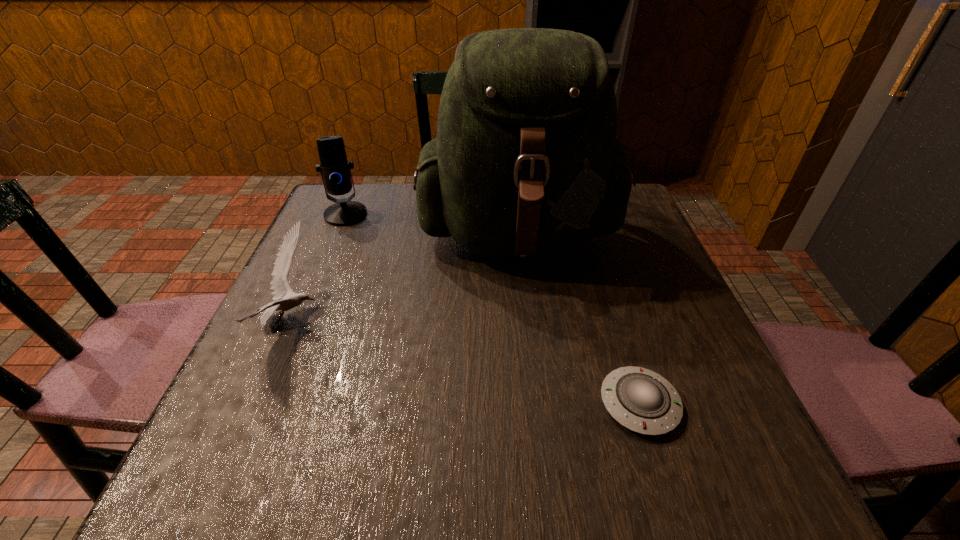
Locate an element on the screen. This screenshot has width=960, height=540. object located in the near edge section of the desktop is located at coordinates (641, 400).

The width and height of the screenshot is (960, 540). What are the coordinates of `microphone that is at the left edge` in the screenshot? It's located at (334, 168).

Find the location of a particular element. Image resolution: width=960 pixels, height=540 pixels. gull that is at the left edge is located at coordinates coord(280,287).

Find the location of `backpack that is at the right edge`. backpack that is at the right edge is located at coordinates (526, 161).

Where is `saucer that is at the right edge`? saucer that is at the right edge is located at coordinates (641, 400).

Identify the location of object situated at the far left corner. click(x=334, y=168).

Where is `object at the far right corner`? This screenshot has height=540, width=960. object at the far right corner is located at coordinates (526, 161).

The image size is (960, 540). Find the location of `object positioned at the near right corner`. object positioned at the near right corner is located at coordinates (641, 400).

Locate an element on the screen. The image size is (960, 540). vacant space at the left edge is located at coordinates (298, 309).

What are the coordinates of `free space at the right edge` in the screenshot? It's located at (732, 418).